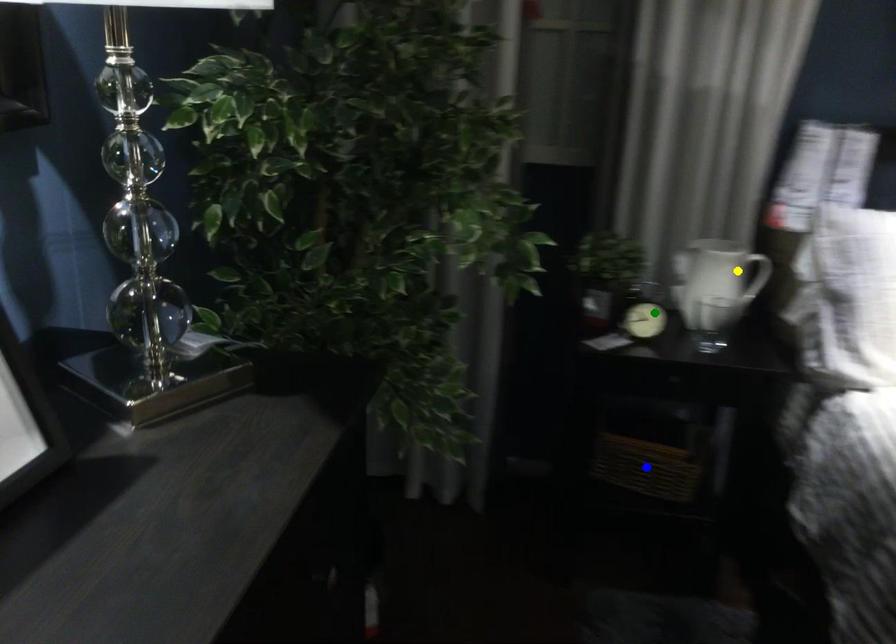
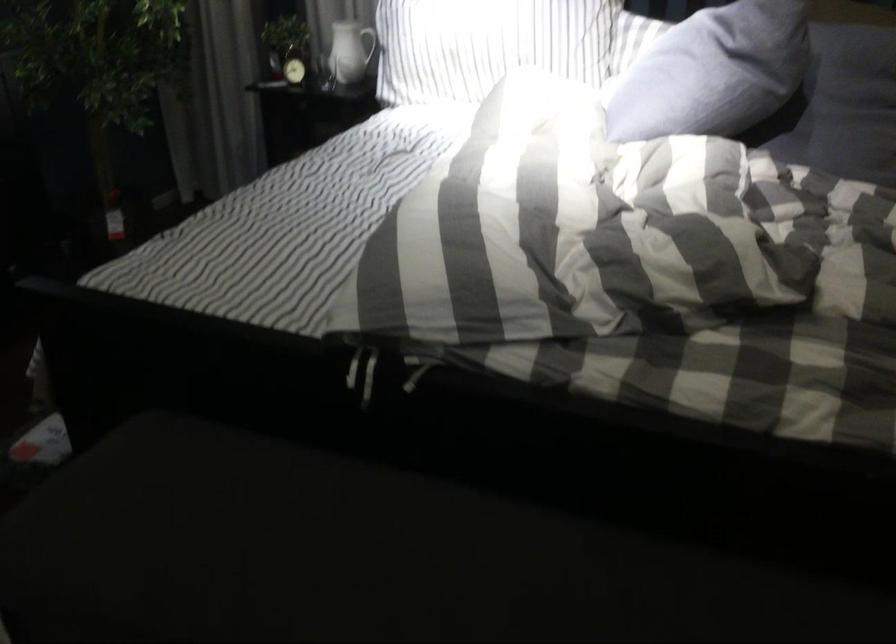
I am providing you with two images of the same scene from different viewpoints. Three points are marked in image1. Which point corresponds to a part or object that is occluded in image2?In image1, three points are marked. Which of them correspond to a part or object that is occluded in image2?Among the three points shown in image1, which one corresponds to a part or object that is no longer visible due to occlusion in image2?

blue point